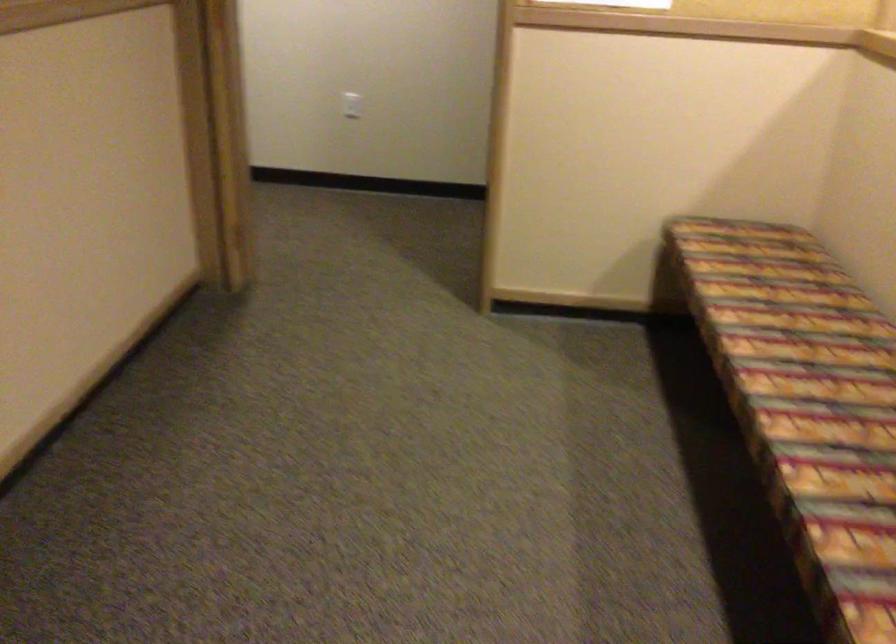
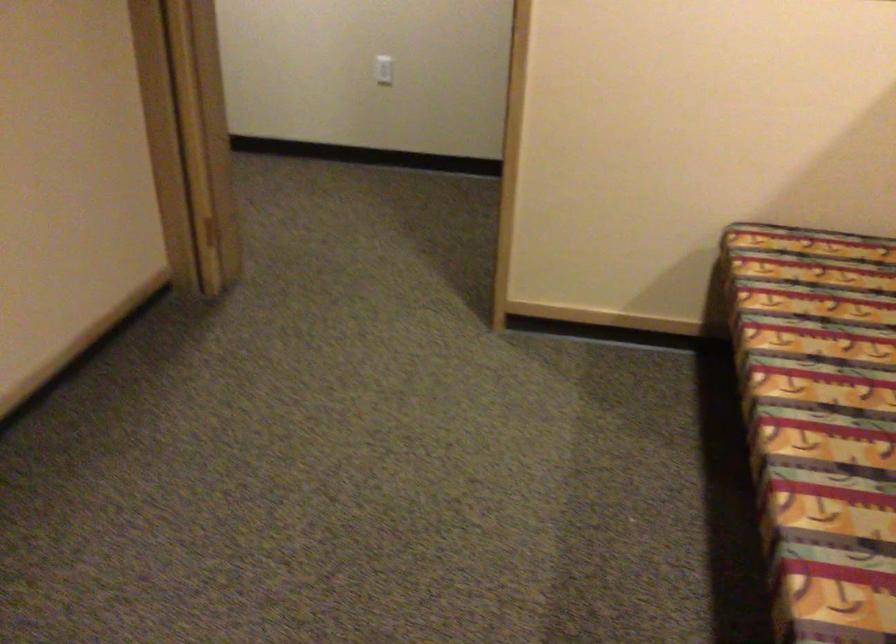
Locate, in the second image, the point that corresponds to pixel 355 106 in the first image.

(383, 70)